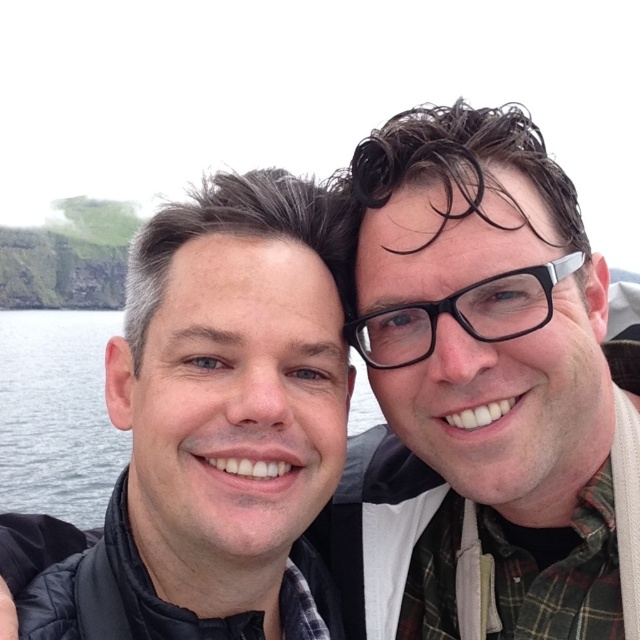
Question: Does matte black jacket at left appear on the left side of black plastic glasses at right?

Choices:
 (A) no
 (B) yes

Answer: (B)

Question: Does matte black jacket at left have a smaller size compared to black plastic glasses at right?

Choices:
 (A) yes
 (B) no

Answer: (B)

Question: Which point is farther from the camera taking this photo?

Choices:
 (A) (420, 333)
 (B) (195, 528)

Answer: (A)

Question: Observing the image, what is the correct spatial positioning of matte black jacket at left in reference to black plastic glasses at right?

Choices:
 (A) left
 (B) right

Answer: (A)

Question: Which point is farther to the camera?

Choices:
 (A) (154, 273)
 (B) (461, 321)

Answer: (A)